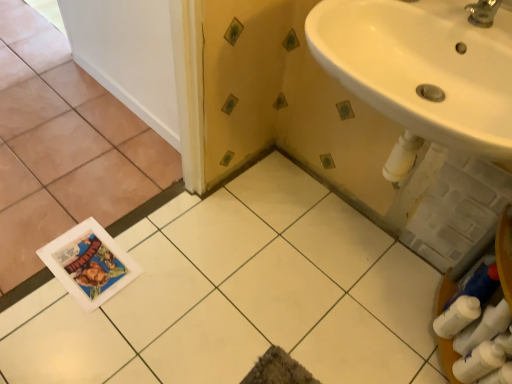
Measure the distance between point (446, 324) and camera.

Point (446, 324) and camera are 1.21 meters apart from each other.

The image size is (512, 384). I want to click on white smooth door at upper left, so click(128, 55).

At what (x,y) coordinates should I click in order to perform the action: click on white glossy sink at upper right. Please return your answer as a coordinate pair (x, y). Looking at the image, I should click on point(422,67).

Measure the distance between point (210, 319) and camera.

A distance of 1.30 meters exists between point (210, 319) and camera.

I want to click on white matte toilet paper at lower right, so click(457, 316).

The width and height of the screenshot is (512, 384). I want to click on ceramic tile that appears behind the white matte toilet paper at lower right, so click(65, 151).

What's the angular difference between white glossy tile at lower left, which is the second ceramic tile in right-to-left order, and white matte toilet paper at lower right's facing directions?

The angular difference between white glossy tile at lower left, which is the second ceramic tile in right-to-left order, and white matte toilet paper at lower right is 140 degrees.

Is white glossy tile at lower left, which appears as the 1th ceramic tile when viewed from the left, located outside white matte toilet paper at lower right?

That's correct, white glossy tile at lower left, which appears as the 1th ceramic tile when viewed from the left, is outside of white matte toilet paper at lower right.

Considering the relative positions of white glossy tile at lower left, which appears as the 1th ceramic tile when viewed from the left, and white matte toilet paper at lower right in the image provided, is white glossy tile at lower left, which appears as the 1th ceramic tile when viewed from the left, in front of white matte toilet paper at lower right?

No, white glossy tile at lower left, which appears as the 1th ceramic tile when viewed from the left, is behind white matte toilet paper at lower right.

In the image, is white smooth door at upper left on the left side or the right side of white glossy tile at center, arranged as the 2th ceramic tile when viewed from the left?

Clearly, white smooth door at upper left is on the left of white glossy tile at center, arranged as the 2th ceramic tile when viewed from the left, in the image.

How far apart are white smooth door at upper left and white glossy tile at center, arranged as the 2th ceramic tile when viewed from the left?

white smooth door at upper left and white glossy tile at center, arranged as the 2th ceramic tile when viewed from the left, are 27.52 inches apart.

Does white smooth door at upper left touch white glossy tile at center, marked as the 1th ceramic tile in a right-to-left arrangement?

No, white smooth door at upper left is not touching white glossy tile at center, marked as the 1th ceramic tile in a right-to-left arrangement.

From the image's perspective, is white smooth door at upper left located above white glossy tile at center, marked as the 1th ceramic tile in a right-to-left arrangement?

Yes, from the image's perspective, white smooth door at upper left is on top of white glossy tile at center, marked as the 1th ceramic tile in a right-to-left arrangement.

Is white glossy tile at center, arranged as the 2th ceramic tile when viewed from the left, looking in the opposite direction of white glossy sink at upper right?

No, white glossy tile at center, arranged as the 2th ceramic tile when viewed from the left, is not facing away from white glossy sink at upper right.

Where is `ceramic tile that is the 1st one when counting backward from the white glossy sink at upper right`? The height and width of the screenshot is (384, 512). ceramic tile that is the 1st one when counting backward from the white glossy sink at upper right is located at coordinates (240, 295).

Does white glossy tile at center, marked as the 1th ceramic tile in a right-to-left arrangement, have a lesser width compared to white glossy sink at upper right?

Incorrect, the width of white glossy tile at center, marked as the 1th ceramic tile in a right-to-left arrangement, is not less than that of white glossy sink at upper right.

From the image's perspective, is white glossy tile at center, arranged as the 2th ceramic tile when viewed from the left, under white glossy sink at upper right?

Yes, from the image's perspective, white glossy tile at center, arranged as the 2th ceramic tile when viewed from the left, is beneath white glossy sink at upper right.

Find the location of a particular element. This screenshot has width=512, height=384. ceramic tile in front of the white matte toilet paper at lower right is located at coordinates (240, 295).

From the image's perspective, does white matte toilet paper at lower right appear higher than white glossy tile at center, arranged as the 2th ceramic tile when viewed from the left?

Yes, from the image's perspective, white matte toilet paper at lower right is over white glossy tile at center, arranged as the 2th ceramic tile when viewed from the left.

Which object is wider, white matte toilet paper at lower right or white glossy tile at center, marked as the 1th ceramic tile in a right-to-left arrangement?

white glossy tile at center, marked as the 1th ceramic tile in a right-to-left arrangement, is wider.

Is white matte toilet paper at lower right facing towards white glossy tile at center, arranged as the 2th ceramic tile when viewed from the left?

Yes, white matte toilet paper at lower right is facing white glossy tile at center, arranged as the 2th ceramic tile when viewed from the left.

Does white smooth door at upper left contain white matte toilet paper at lower right?

No, white matte toilet paper at lower right is not a part of white smooth door at upper left.

Would you say white smooth door at upper left is to the left or to the right of white matte toilet paper at lower right in the picture?

In the image, white smooth door at upper left appears on the left side of white matte toilet paper at lower right.

From a real-world perspective, is white smooth door at upper left physically below white matte toilet paper at lower right?

Yes, from a real-world perspective, white smooth door at upper left is beneath white matte toilet paper at lower right.

Is point (215, 277) farther from viewer compared to point (1, 274)?

Yes, it is behind point (1, 274).

Would you say white glossy tile at center, marked as the 1th ceramic tile in a right-to-left arrangement, contains white glossy tile at lower left, which appears as the 1th ceramic tile when viewed from the left?

Definitely not — white glossy tile at lower left, which appears as the 1th ceramic tile when viewed from the left, is not inside white glossy tile at center, marked as the 1th ceramic tile in a right-to-left arrangement.

Where is `ceramic tile behind the white glossy tile at center, marked as the 1th ceramic tile in a right-to-left arrangement`? ceramic tile behind the white glossy tile at center, marked as the 1th ceramic tile in a right-to-left arrangement is located at coordinates (65, 151).

Between white glossy tile at center, arranged as the 2th ceramic tile when viewed from the left, and white glossy tile at lower left, which is the second ceramic tile in right-to-left order, which one has less height?

Standing shorter between the two is white glossy tile at center, arranged as the 2th ceramic tile when viewed from the left.

Consider the image. From the image's perspective, is white glossy sink at upper right below white smooth door at upper left?

Yes, from the image's perspective, white glossy sink at upper right is below white smooth door at upper left.

Is white glossy sink at upper right oriented towards white smooth door at upper left?

No.

What's the angular difference between white glossy sink at upper right and white smooth door at upper left's facing directions?

The angular difference between white glossy sink at upper right and white smooth door at upper left is 0.554 degrees.

Is white glossy sink at upper right taller or shorter than white smooth door at upper left?

Considering their sizes, white glossy sink at upper right has more height than white smooth door at upper left.

Locate an element on the screen. This screenshot has height=384, width=512. toilet paper above the white glossy tile at lower left, which is the second ceramic tile in right-to-left order (from a real-world perspective) is located at coordinates (457, 316).

Locate an element on the screen. This screenshot has width=512, height=384. door that is on the left side of white glossy tile at center, marked as the 1th ceramic tile in a right-to-left arrangement is located at coordinates point(128,55).

Looking at this image, looking at the image, which one is located closer to white matte toilet paper at lower right, white glossy sink at upper right or white smooth door at upper left?

white glossy sink at upper right is positioned closer to the anchor white matte toilet paper at lower right.

Looking at this image, considering their positions, is white matte toilet paper at lower right positioned further to white glossy tile at lower left, which appears as the 1th ceramic tile when viewed from the left, than white glossy sink at upper right?

white matte toilet paper at lower right lies further to white glossy tile at lower left, which appears as the 1th ceramic tile when viewed from the left, than the other object.

Based on their spatial positions, is white glossy tile at lower left, which is the second ceramic tile in right-to-left order, or white smooth door at upper left further from white matte toilet paper at lower right?

Among the two, white smooth door at upper left is located further to white matte toilet paper at lower right.

When comparing their distances from white glossy tile at lower left, which appears as the 1th ceramic tile when viewed from the left, does white glossy sink at upper right or white matte toilet paper at lower right seem further?

white matte toilet paper at lower right lies further to white glossy tile at lower left, which appears as the 1th ceramic tile when viewed from the left, than the other object.

Based on their spatial positions, is white glossy tile at center, arranged as the 2th ceramic tile when viewed from the left, or white matte toilet paper at lower right further from white smooth door at upper left?

white matte toilet paper at lower right lies further to white smooth door at upper left than the other object.

Estimate the real-world distances between objects in this image. Which object is further from white glossy sink at upper right, white glossy tile at center, arranged as the 2th ceramic tile when viewed from the left, or white glossy tile at lower left, which is the second ceramic tile in right-to-left order?

The object further to white glossy sink at upper right is white glossy tile at lower left, which is the second ceramic tile in right-to-left order.

Based on their spatial positions, is white glossy sink at upper right or white matte toilet paper at lower right further from white glossy tile at center, marked as the 1th ceramic tile in a right-to-left arrangement?

white glossy sink at upper right is positioned further to the anchor white glossy tile at center, marked as the 1th ceramic tile in a right-to-left arrangement.

Considering their positions, is white matte toilet paper at lower right positioned further to white glossy tile at center, marked as the 1th ceramic tile in a right-to-left arrangement, than white smooth door at upper left?

white smooth door at upper left is positioned further to the anchor white glossy tile at center, marked as the 1th ceramic tile in a right-to-left arrangement.

This screenshot has height=384, width=512. What are the coordinates of `sink situated between white glossy tile at lower left, which is the second ceramic tile in right-to-left order, and white matte toilet paper at lower right from left to right` in the screenshot? It's located at (422, 67).

Where is `sink located between white smooth door at upper left and white matte toilet paper at lower right in the left-right direction`? sink located between white smooth door at upper left and white matte toilet paper at lower right in the left-right direction is located at coordinates (422, 67).

Find the location of `toilet paper between white glossy sink at upper right and white glossy tile at center, arranged as the 2th ceramic tile when viewed from the left, in the up-down direction`. toilet paper between white glossy sink at upper right and white glossy tile at center, arranged as the 2th ceramic tile when viewed from the left, in the up-down direction is located at coordinates (457, 316).

Find the location of a particular element. This screenshot has width=512, height=384. ceramic tile located between white glossy tile at lower left, which is the second ceramic tile in right-to-left order, and white matte toilet paper at lower right in the left-right direction is located at coordinates (240, 295).